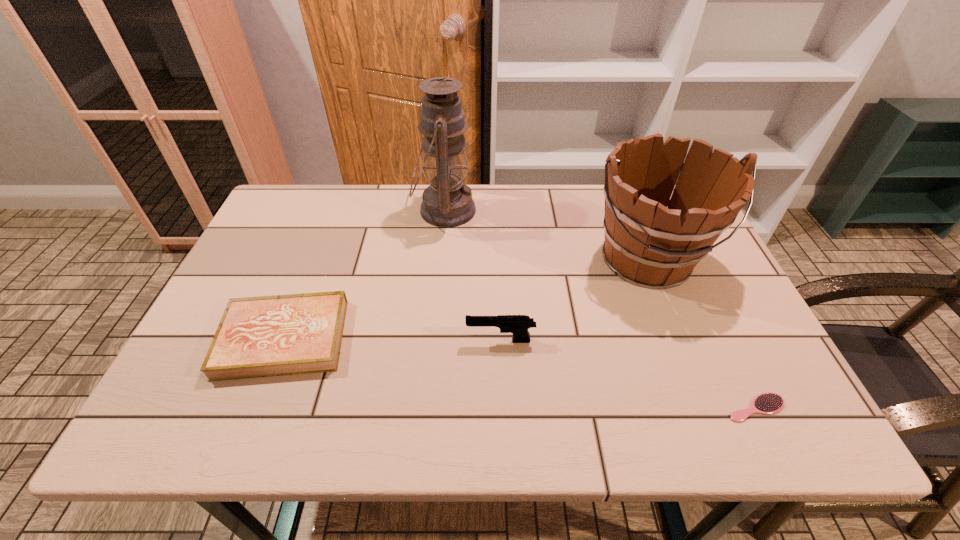
Locate an element on the screen. vacant space located on the front-facing side of the third shortest object is located at coordinates (345, 341).

Locate an element on the screen. free point located on the front-facing side of the third shortest object is located at coordinates (414, 341).

You are a GUI agent. You are given a task and a screenshot of the screen. Output one action in this format:
    pyautogui.click(x=<x>, y=<y>)
    Task: Click on the free location located on the back of the fourth tallest object
    
    Given the screenshot: What is the action you would take?
    pyautogui.click(x=320, y=246)

The image size is (960, 540). What are the coordinates of `free region located 0.180m on the left of the nearest object` in the screenshot? It's located at (636, 408).

At what (x,y) coordinates should I click in order to perform the action: click on oil lamp located in the far edge section of the desktop. Please return your answer as a coordinate pair (x, y). Looking at the image, I should click on (447, 202).

Locate an element on the screen. wine bucket located at the far edge is located at coordinates (650, 245).

What are the coordinates of `object situated at the near edge` in the screenshot? It's located at (767, 403).

You are a GUI agent. You are given a task and a screenshot of the screen. Output one action in this format:
    pyautogui.click(x=<x>, y=<y>)
    Task: Click on the object at the left edge
    The image size is (960, 540).
    Given the screenshot: What is the action you would take?
    pyautogui.click(x=264, y=336)

Where is `wine bucket that is at the right edge`? wine bucket that is at the right edge is located at coordinates (650, 245).

Where is `hairbrush present at the right edge`? hairbrush present at the right edge is located at coordinates (767, 403).